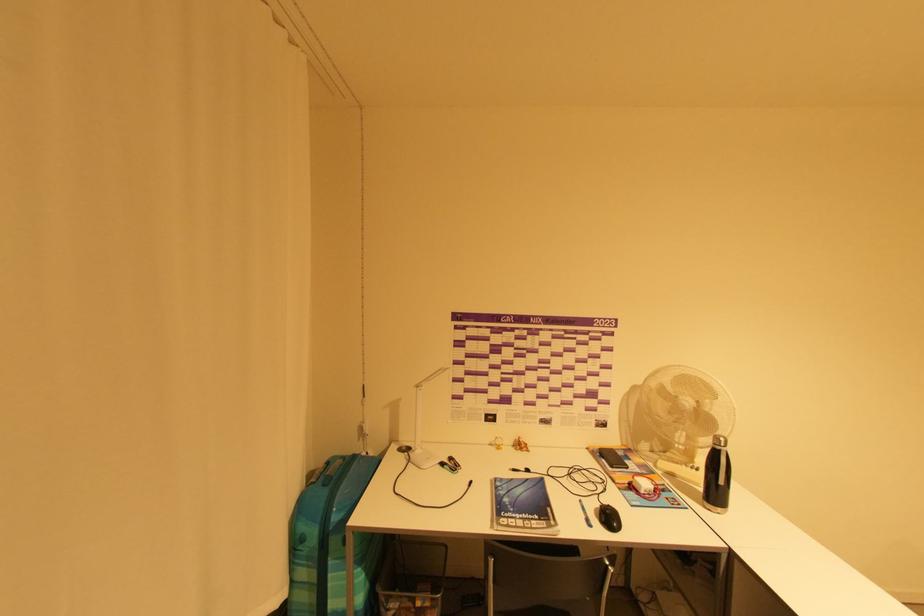
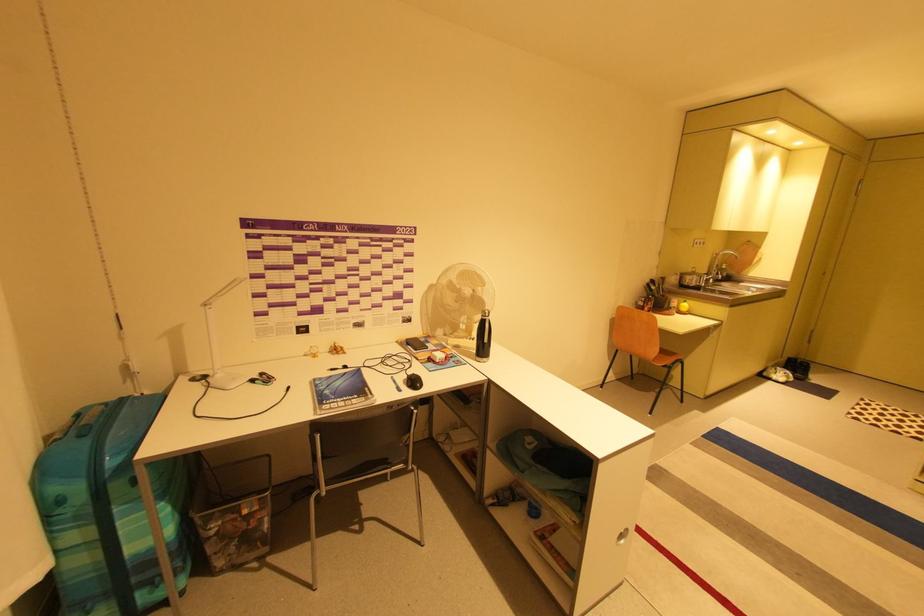
The point at [517,480] is marked in the first image. Where is the corresponding point in the second image?

(336, 377)